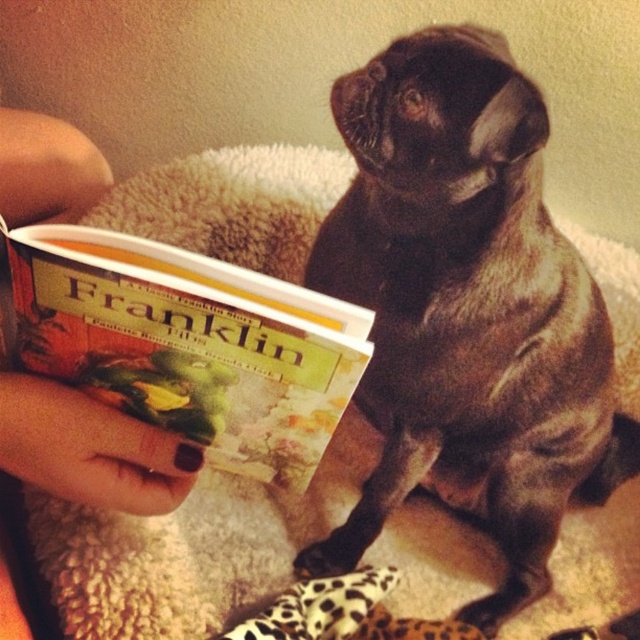
Between hardcover book at upper left and nail polish at upper left, which one has less height?

Standing shorter between the two is hardcover book at upper left.

Consider the image. Can you confirm if hardcover book at upper left is bigger than nail polish at upper left?

Indeed, hardcover book at upper left has a larger size compared to nail polish at upper left.

Locate an element on the screen. This screenshot has width=640, height=640. hardcover book at upper left is located at coordinates (189, 344).

How much distance is there between brown furry dog at center and hardcover book at upper left?

The distance of brown furry dog at center from hardcover book at upper left is 11.34 inches.

I want to click on brown furry dog at center, so click(467, 308).

Does point (596, 349) come behind point (220, 269)?

Yes, it is behind point (220, 269).

This screenshot has height=640, width=640. Identify the location of brown furry dog at center. (467, 308).

Which is more to the right, brown furry dog at center or nail polish at upper left?

brown furry dog at center

Is brown furry dog at center to the left of nail polish at upper left from the viewer's perspective?

No, brown furry dog at center is not to the left of nail polish at upper left.

Does point (458, 88) come behind point (141, 484)?

That is True.

Find the location of a particular element. brown furry dog at center is located at coordinates (467, 308).